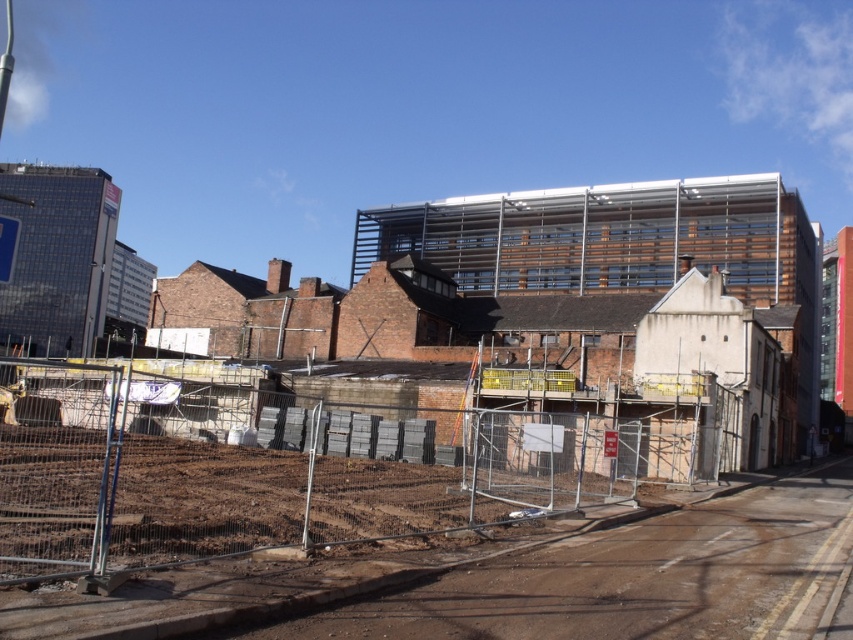
Question: Which object appears farthest from the camera in this image?

Choices:
 (A) metal scaffolding at center
 (B) brown dirt track at lower left

Answer: (A)

Question: Can you confirm if metal scaffolding at center is bigger than brown dirt track at lower left?

Choices:
 (A) yes
 (B) no

Answer: (A)

Question: Which point is closer to the camera?

Choices:
 (A) brown dirt track at lower left
 (B) metal scaffolding at center

Answer: (A)

Question: Does metal scaffolding at center have a smaller size compared to brown dirt track at lower left?

Choices:
 (A) no
 (B) yes

Answer: (A)

Question: In this image, where is metal scaffolding at center located relative to brown dirt track at lower left?

Choices:
 (A) below
 (B) above

Answer: (B)